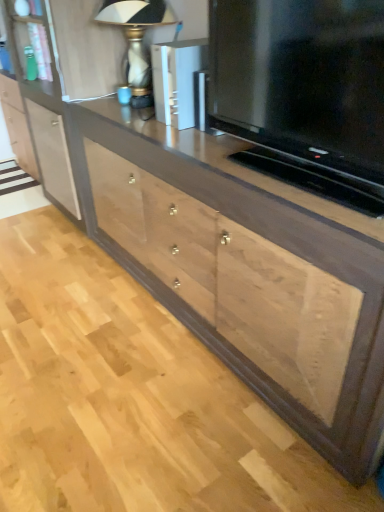
Question: From the image's perspective, would you say matte black television at center is shown under natural wood drawer at center?

Choices:
 (A) yes
 (B) no

Answer: (B)

Question: Is natural wood drawer at center inside matte black television at center?

Choices:
 (A) no
 (B) yes

Answer: (A)

Question: Is matte black television at center facing away from natural wood drawer at center?

Choices:
 (A) no
 (B) yes

Answer: (A)

Question: Is matte black television at center closer to the viewer compared to natural wood drawer at center?

Choices:
 (A) no
 (B) yes

Answer: (B)

Question: Can we say matte black television at center lies outside natural wood drawer at center?

Choices:
 (A) yes
 (B) no

Answer: (A)

Question: Is matte black television at center taller than natural wood drawer at center?

Choices:
 (A) no
 (B) yes

Answer: (A)

Question: Is metallic silver speaker at upper center surrounded by matte black television at center?

Choices:
 (A) yes
 (B) no

Answer: (B)

Question: Considering the relative sizes of matte black television at center and metallic silver speaker at upper center in the image provided, is matte black television at center bigger than metallic silver speaker at upper center?

Choices:
 (A) no
 (B) yes

Answer: (B)

Question: Does matte black television at center have a greater width compared to metallic silver speaker at upper center?

Choices:
 (A) no
 (B) yes

Answer: (A)

Question: Is matte black television at center placed right next to metallic silver speaker at upper center?

Choices:
 (A) yes
 (B) no

Answer: (B)

Question: Is the position of matte black television at center more distant than that of metallic silver speaker at upper center?

Choices:
 (A) yes
 (B) no

Answer: (B)

Question: From a real-world perspective, is matte black television at center positioned under metallic silver speaker at upper center based on gravity?

Choices:
 (A) no
 (B) yes

Answer: (A)

Question: Can you confirm if matte glass table lamp at upper center is wider than matte black television at center?

Choices:
 (A) yes
 (B) no

Answer: (A)